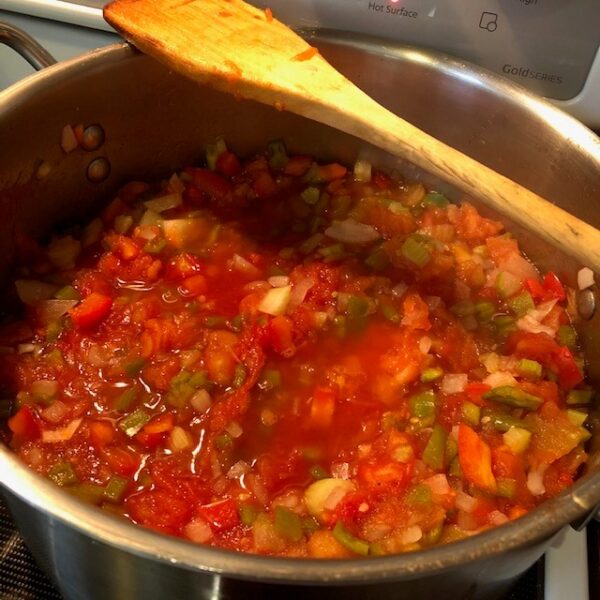
Where is `pot`? pot is located at coordinates (147, 100).